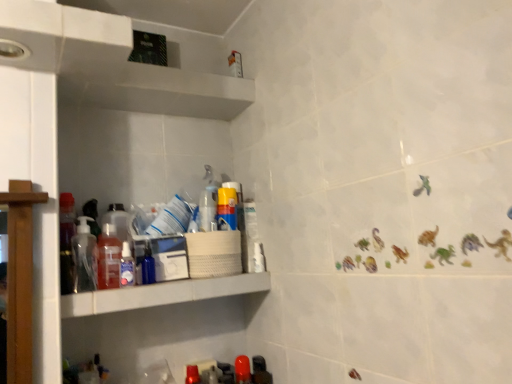
This screenshot has width=512, height=384. I want to click on free location to the right of transparent plastic bottle at shelf left, which appears as the fourth bottle when viewed from the left, so click(176, 281).